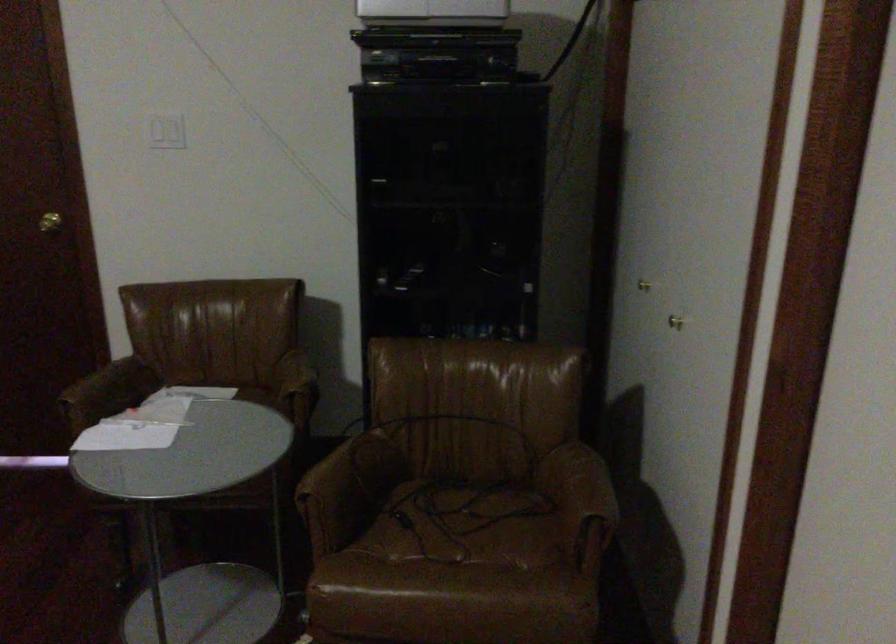
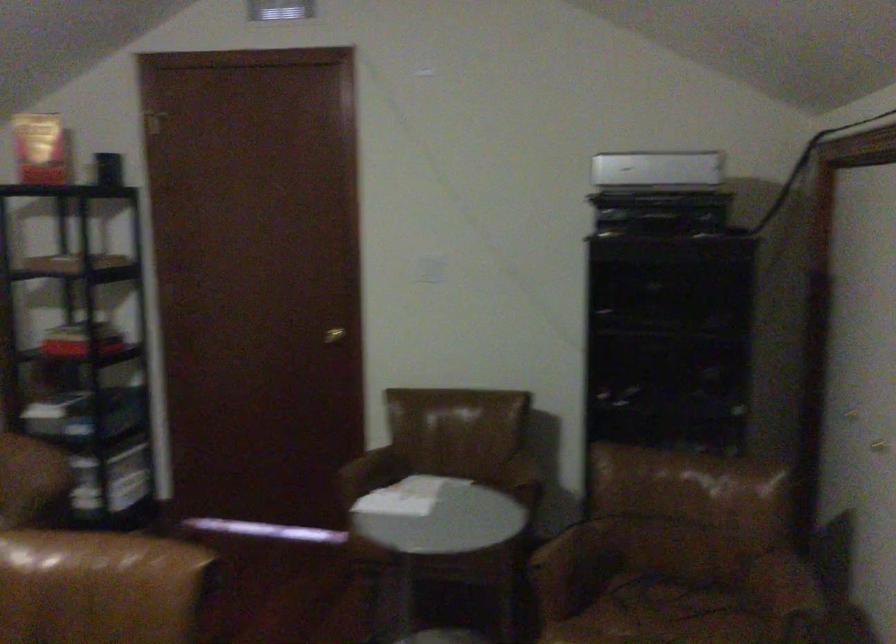
Question: The camera is either moving clockwise (left) or counter-clockwise (right) around the object. The first image is from the beginning of the video and the second image is from the end. Is the camera moving left or right when shooting the video?

Choices:
 (A) Left
 (B) Right

Answer: (B)